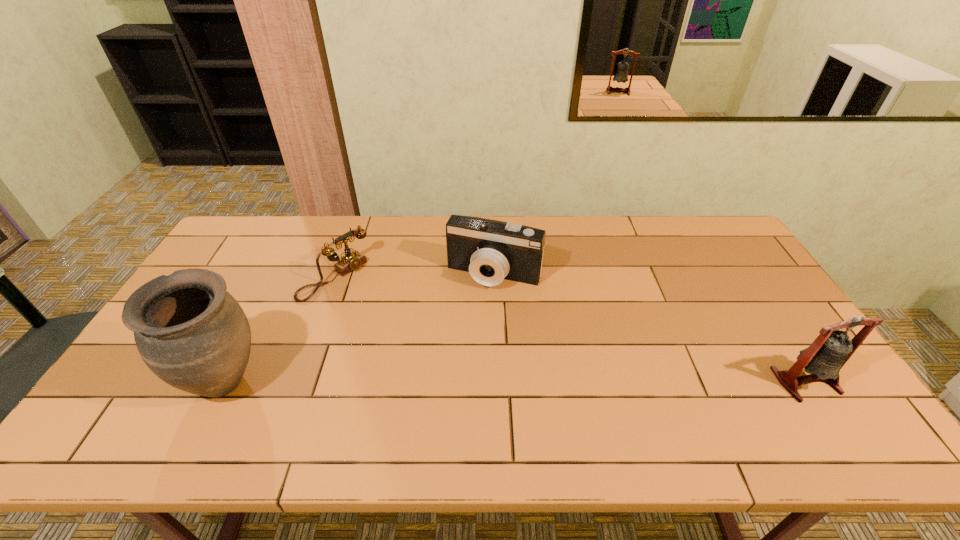
Where is `vacant space situated 0.170m on the lens of the second object from right to left`? vacant space situated 0.170m on the lens of the second object from right to left is located at coordinates (464, 334).

The image size is (960, 540). What are the coordinates of `vacant area situated on the front-facing side of the telephone` in the screenshot? It's located at point(372,308).

Find the location of a particular element. This screenshot has height=540, width=960. vacant area situated 0.280m on the front-facing side of the telephone is located at coordinates (416, 340).

Locate an element on the screen. The height and width of the screenshot is (540, 960). vacant space situated on the front-facing side of the telephone is located at coordinates (374, 309).

Where is `object present at the far edge`? The image size is (960, 540). object present at the far edge is located at coordinates (350, 261).

At what (x,y) coordinates should I click in order to perform the action: click on urn situated at the near edge. Please return your answer as a coordinate pair (x, y). The width and height of the screenshot is (960, 540). Looking at the image, I should click on (191, 333).

I want to click on bell present at the near edge, so click(x=823, y=359).

Image resolution: width=960 pixels, height=540 pixels. In order to click on object that is at the left edge in this screenshot , I will do 191,333.

You are a GUI agent. You are given a task and a screenshot of the screen. Output one action in this format:
    pyautogui.click(x=<x>, y=<y>)
    Task: Click on the object that is at the right edge
    The width and height of the screenshot is (960, 540).
    Given the screenshot: What is the action you would take?
    coord(823,359)

Where is `object present at the near left corner`? The image size is (960, 540). object present at the near left corner is located at coordinates (191, 333).